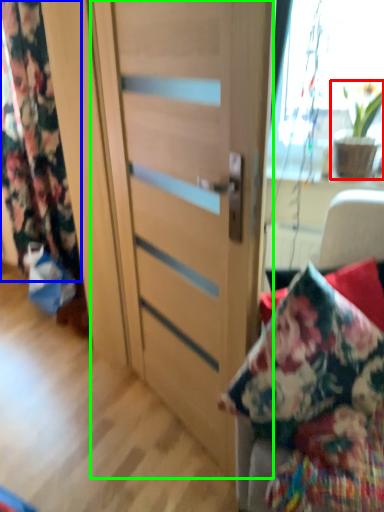
Question: Based on their relative distances, which object is farther from houseplant (highlighted by a red box)? Choose from curtain (highlighted by a blue box) and door (highlighted by a green box).

Choices:
 (A) curtain
 (B) door

Answer: (A)